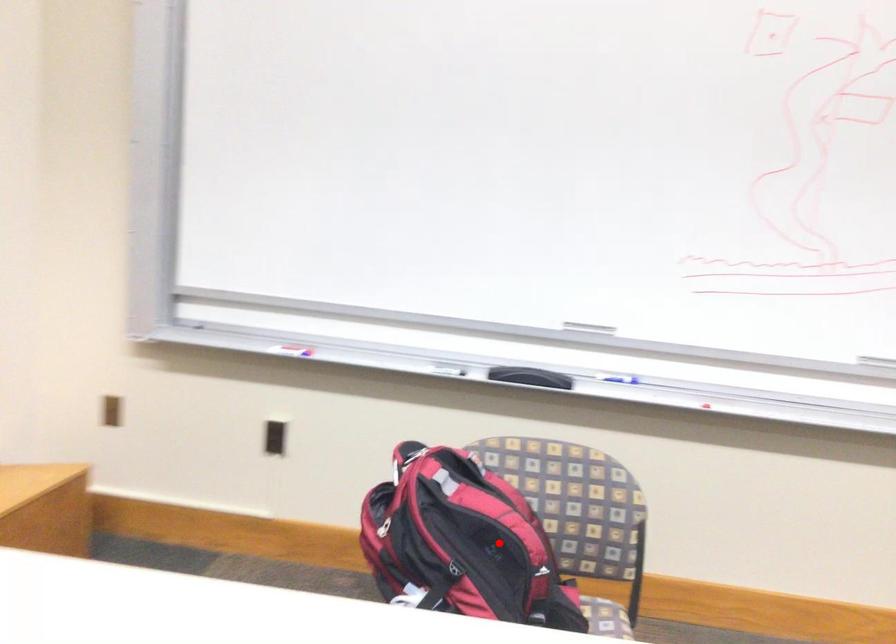
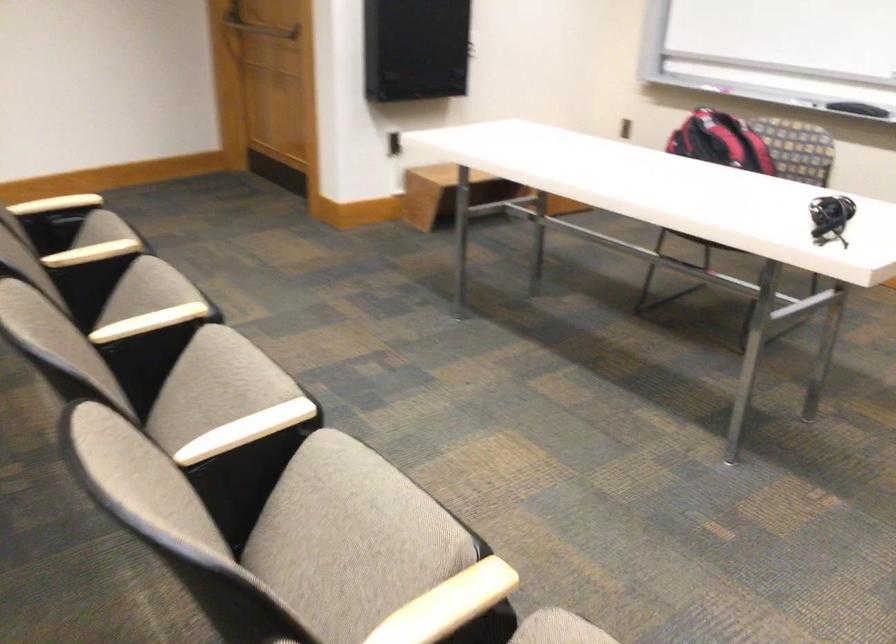
Find the pixel in the second image that matches the highlighted location in the first image.

(720, 142)